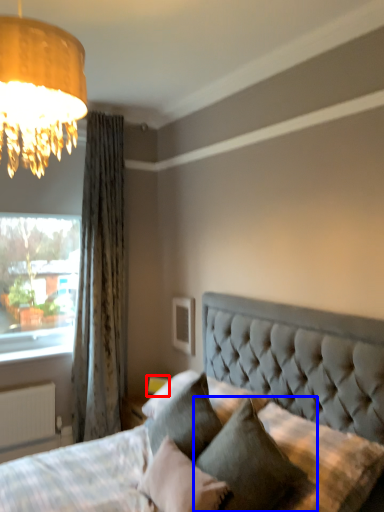
Question: Which of the following is the farthest to the observer, table lamp (highlighted by a red box) or pillow (highlighted by a blue box)?

Choices:
 (A) table lamp
 (B) pillow

Answer: (A)